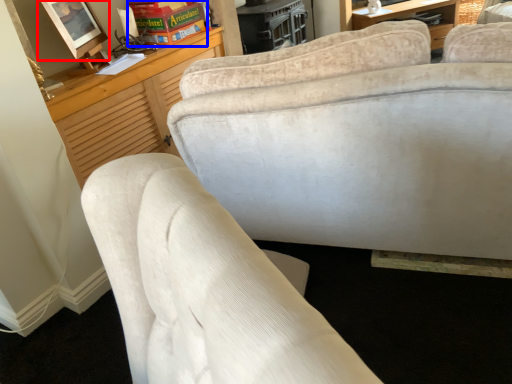
Question: Which of the following is the closest to the observer, picture frame (highlighted by a red box) or book (highlighted by a blue box)?

Choices:
 (A) picture frame
 (B) book

Answer: (A)